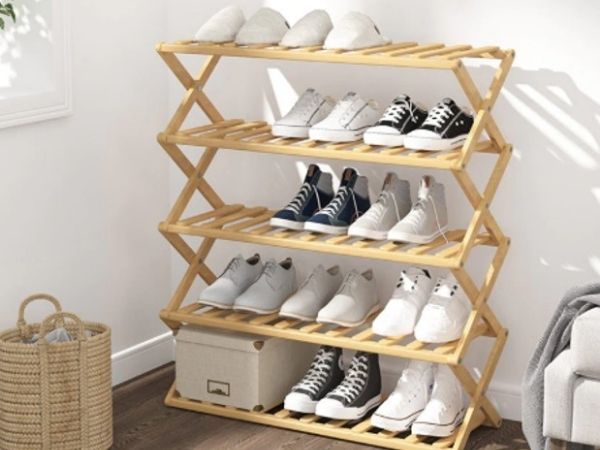
The image size is (600, 450). Identify the location of shoes on second shelf from top. 294,126, 339,124, 400,129, 431,133.